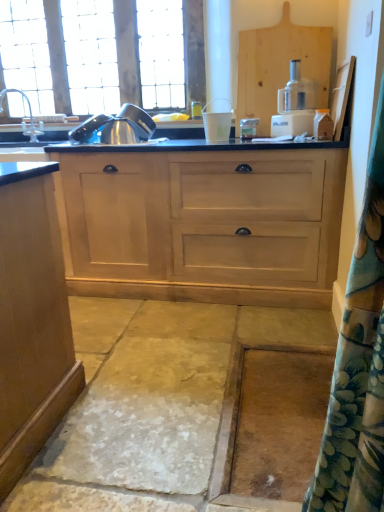
Question: Is white plastic cup at center, placed as the second appliance when sorted from left to right, bigger or smaller than clear glass window at upper left?

Choices:
 (A) small
 (B) big

Answer: (A)

Question: Choose the correct answer: Is white plastic cup at center, acting as the 1th appliance starting from the right, inside clear glass window at upper left or outside it?

Choices:
 (A) inside
 (B) outside

Answer: (B)

Question: Estimate the real-world distances between objects in this image. Which object is farther from the white plastic food processor at center?

Choices:
 (A) wooden cutting board at upper right
 (B) white plastic cup at center, placed as the second appliance when sorted from left to right
 (C) light wood cabinet at center
 (D) stainless steel kettle at upper left, the first appliance from the left
 (E) smooth stone concrete at center

Answer: (E)

Question: Which of these objects is positioned farthest from the silver metallic faucet at left?

Choices:
 (A) white plastic cup at center, placed as the second appliance when sorted from left to right
 (B) wooden cutting board at upper right
 (C) white plastic food processor at center
 (D) clear glass window at upper left
 (E) smooth stone concrete at center

Answer: (E)